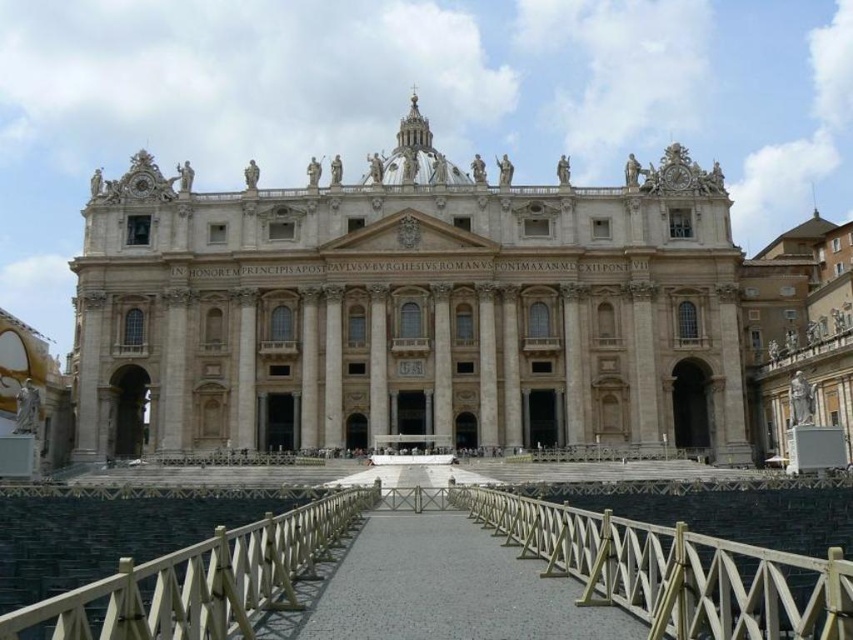
Who is lower down, gold metallic rail at center or wooden at center?

wooden at center is below.

Between gold metallic rail at center and wooden at center, which one is positioned higher?

gold metallic rail at center is above.

Does point (509, 540) come behind point (123, 611)?

Yes, point (509, 540) is behind point (123, 611).

This screenshot has height=640, width=853. In order to click on gold metallic rail at center in this screenshot , I will do `click(674, 572)`.

Does gold metallic rail at center lie behind smooth concrete walkway at center?

No, gold metallic rail at center is in front of smooth concrete walkway at center.

This screenshot has width=853, height=640. Describe the element at coordinates (674, 572) in the screenshot. I see `gold metallic rail at center` at that location.

Is point (608, 556) closer to camera compared to point (408, 564)?

Yes, it is in front of point (408, 564).

You are a GUI agent. You are given a task and a screenshot of the screen. Output one action in this format:
    pyautogui.click(x=<x>, y=<y>)
    Task: Click on the gold metallic rail at center
    The image size is (853, 640).
    Given the screenshot: What is the action you would take?
    pyautogui.click(x=674, y=572)

Does beige stone church at center appear on the right side of wooden at center?

Yes, beige stone church at center is to the right of wooden at center.

Based on the photo, which is below, beige stone church at center or wooden at center?

Positioned lower is wooden at center.

Between point (729, 396) and point (242, 531), which one is positioned behind?

The point (729, 396) is more distant.

Locate an element on the screen. This screenshot has width=853, height=640. beige stone church at center is located at coordinates (426, 308).